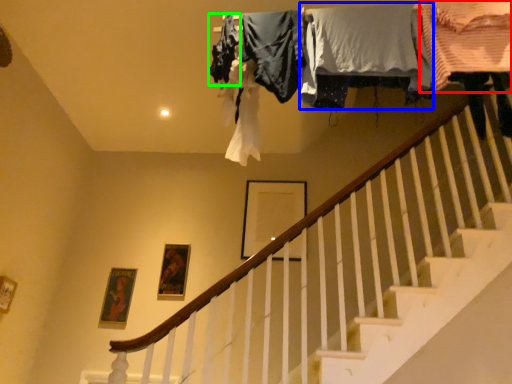
Question: Based on their relative distances, which object is nearer to clothing (highlighted by a red box)? Choose from clothing (highlighted by a blue box) and clothing (highlighted by a green box).

Choices:
 (A) clothing
 (B) clothing

Answer: (A)